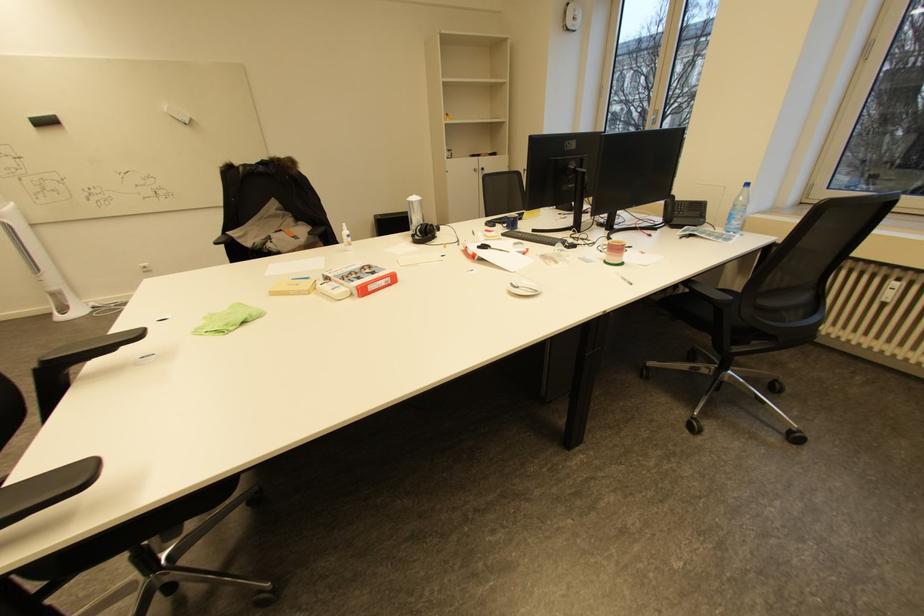
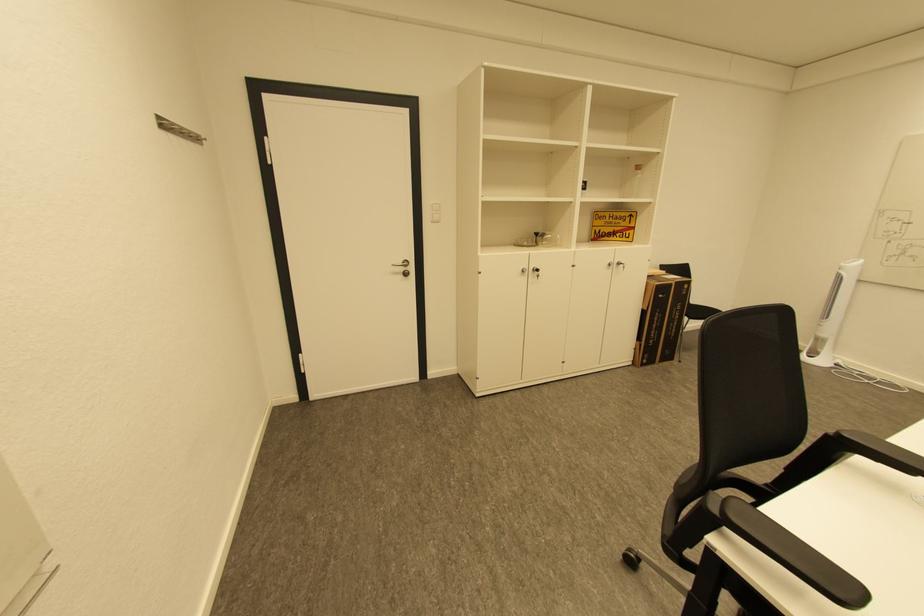
Where in the second image is the point corresponding to point (47, 363) from the first image?

(845, 436)